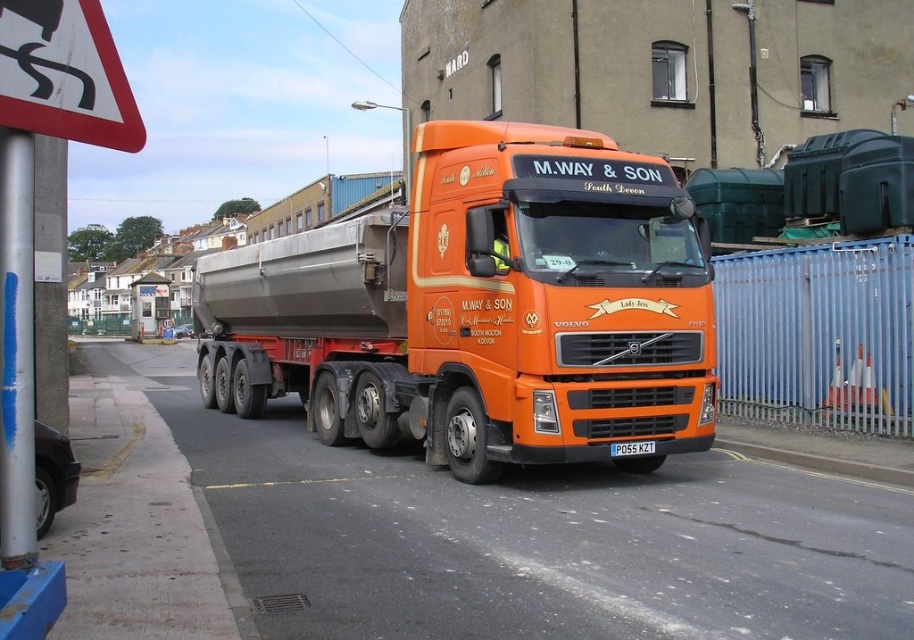
Question: Which object appears farthest from the camera in this image?

Choices:
 (A) white plastic license plate at center
 (B) orange matte truck at center

Answer: (A)

Question: Which object appears closest to the camera in this image?

Choices:
 (A) white plastic license plate at center
 (B) orange matte truck at center
 (C) red plastic triangle at upper left

Answer: (C)

Question: Observing the image, what is the correct spatial positioning of red plastic triangle at upper left in reference to white plastic license plate at center?

Choices:
 (A) right
 (B) left

Answer: (B)

Question: Does orange matte truck at center have a smaller size compared to white plastic license plate at center?

Choices:
 (A) no
 (B) yes

Answer: (A)

Question: Can you confirm if orange matte truck at center is positioned above white plastic license plate at center?

Choices:
 (A) yes
 (B) no

Answer: (A)

Question: Among these points, which one is farthest from the camera?

Choices:
 (A) (30, 92)
 (B) (354, 273)

Answer: (B)